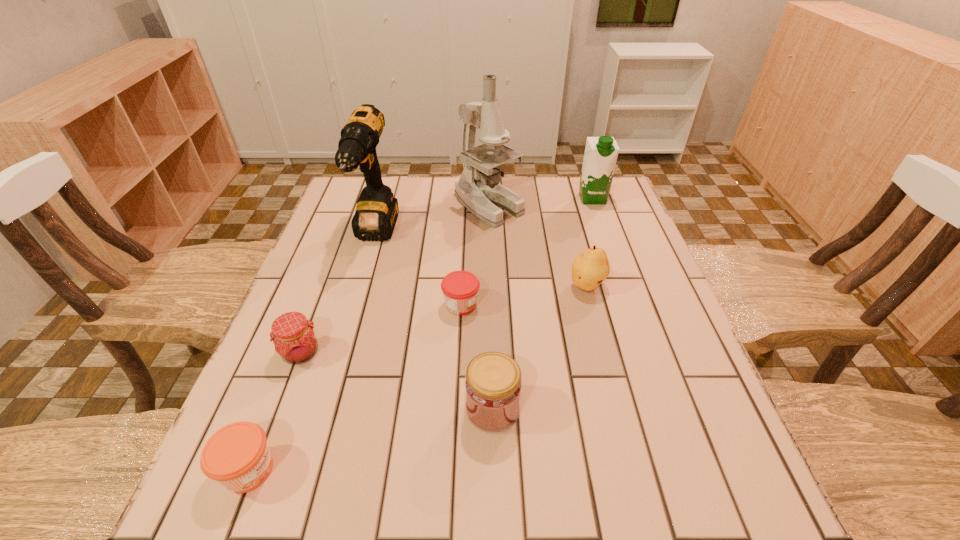
Find the location of a particular element. free location at the right edge is located at coordinates [x=645, y=247].

Identify the location of free space between the nearest object and the seventh farthest object. (371, 440).

At what (x,y) coordinates should I click in order to perform the action: click on empty space that is in between the microscope and the nearest jam. Please return your answer as a coordinate pair (x, y). The width and height of the screenshot is (960, 540). Looking at the image, I should click on (369, 338).

The height and width of the screenshot is (540, 960). I want to click on empty space that is in between the nearest object and the microscope, so click(369, 338).

Find the location of `blank region between the farthest jam and the nearest jam`. blank region between the farthest jam and the nearest jam is located at coordinates (355, 387).

At what (x,y) coordinates should I click in order to perform the action: click on free space that is in between the sixth shortest object and the pear. Please return your answer as a coordinate pair (x, y). This screenshot has height=540, width=960. Looking at the image, I should click on (589, 242).

At what (x,y) coordinates should I click in order to perform the action: click on blank region between the pear and the second tallest object. Please return your answer as a coordinate pair (x, y). This screenshot has height=540, width=960. Looking at the image, I should click on (481, 260).

The width and height of the screenshot is (960, 540). Identify the location of vacant space that's between the third tallest object and the seventh farthest object. (542, 303).

This screenshot has height=540, width=960. Identify the location of unoccupied position between the farthest jam and the drill. (419, 270).

Point out which object is positioned as the seventh nearest to the sixth farthest object. Please provide its 2D coordinates. Your answer should be formatted as a tuple, i.e. [(x, y)], where the tuple contains the x and y coordinates of a point satisfying the conditions above.

[(601, 153)]